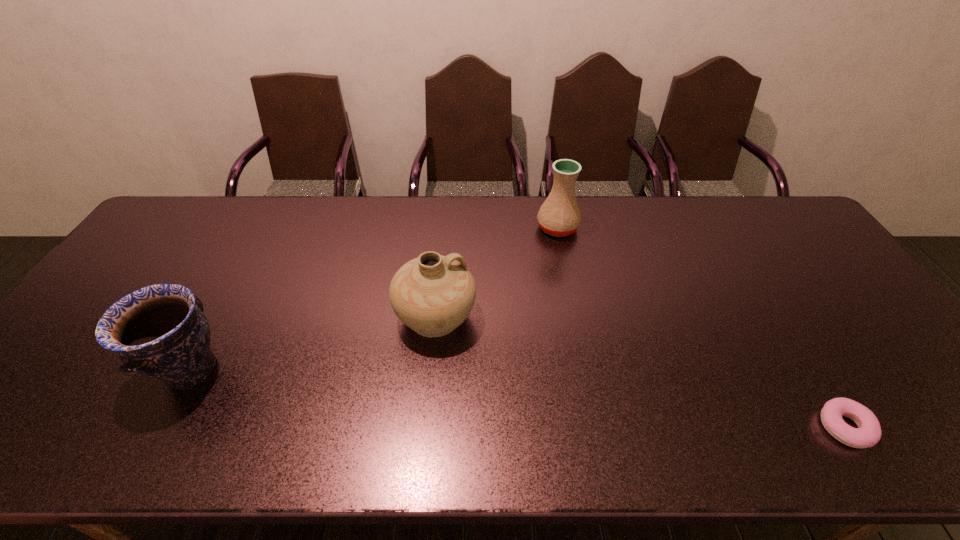
Where is `pottery that stands as the third closest to the rightmost object`? Image resolution: width=960 pixels, height=540 pixels. pottery that stands as the third closest to the rightmost object is located at coordinates (160, 330).

Identify which pottery is the closest to the pastry. Please provide its 2D coordinates. Your answer should be formatted as a tuple, i.e. [(x, y)], where the tuple contains the x and y coordinates of a point satisfying the conditions above.

[(559, 215)]

I want to click on vacant area in the image that satisfies the following two spatial constraints: 1. on the front handle of the pastry; 2. on the left side of the leftmost object, so 160,427.

This screenshot has height=540, width=960. Identify the location of free region that satisfies the following two spatial constraints: 1. on the front side of the second pottery from left to right; 2. on the left side of the rightmost object. (425, 427).

The height and width of the screenshot is (540, 960). Identify the location of vacant area that satisfies the following two spatial constraints: 1. on the back side of the second object from right to left; 2. on the right side of the second pottery from right to left. (x=444, y=228).